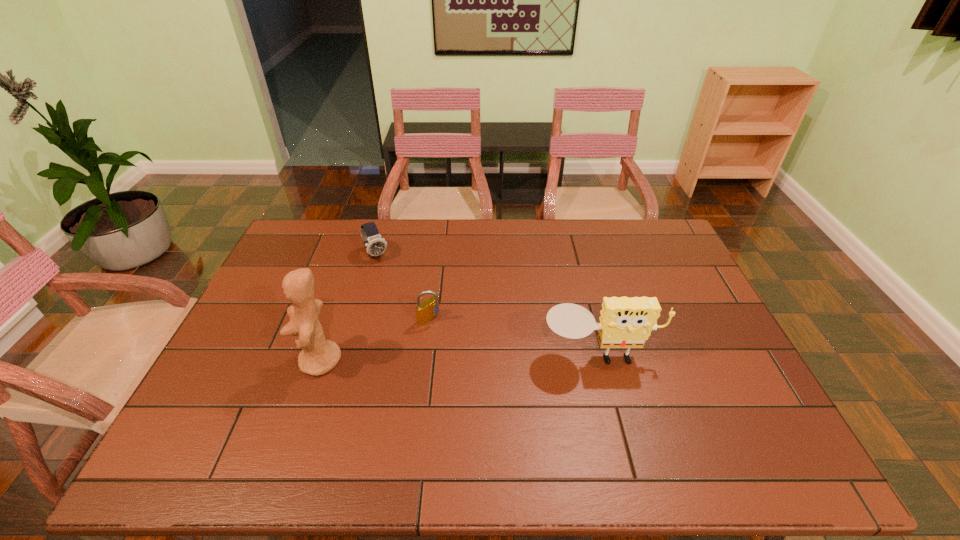
In order to click on vacant space at the near left corner of the desktop in this screenshot , I will do `click(193, 410)`.

Identify the location of empty space between the farthest object and the padlock. The height and width of the screenshot is (540, 960). (402, 287).

Locate an element on the screen. The image size is (960, 540). vacant space in between the sponge and the farthest object is located at coordinates (488, 306).

Locate an element on the screen. The image size is (960, 540). free space between the tallest object and the farthest object is located at coordinates (348, 308).

Locate an element on the screen. Image resolution: width=960 pixels, height=540 pixels. empty space between the third object from left to right and the rightmost object is located at coordinates (515, 338).

Identify the location of blank region between the second tallest object and the farthest object. Image resolution: width=960 pixels, height=540 pixels. (488, 306).

The height and width of the screenshot is (540, 960). What are the coordinates of `free space between the third shortest object and the watch` in the screenshot? It's located at (488, 306).

Locate an element on the screen. vacant area that lies between the sponge and the farthest object is located at coordinates pos(488,306).

This screenshot has height=540, width=960. I want to click on vacant space that's between the sponge and the figurine, so (460, 359).

The image size is (960, 540). In order to click on vacant area that lies between the padlock and the rightmost object in this screenshot , I will do `click(515, 338)`.